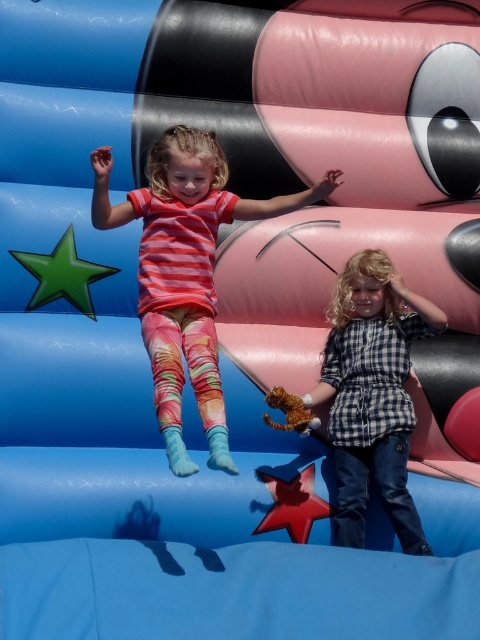
Question: Which point is farther from the camera taking this photo?

Choices:
 (A) (346, 465)
 (B) (170, 339)

Answer: (A)

Question: Among these points, which one is nearest to the camera?

Choices:
 (A) (391, 490)
 (B) (173, 328)

Answer: (B)

Question: Which object appears farthest from the camera in this image?

Choices:
 (A) checkered fabric shirt at center
 (B) striped cotton shirt at upper center

Answer: (A)

Question: Does striped cotton shirt at upper center appear over checkered fabric shirt at center?

Choices:
 (A) yes
 (B) no

Answer: (A)

Question: Can you confirm if striped cotton shirt at upper center is positioned to the right of checkered fabric shirt at center?

Choices:
 (A) yes
 (B) no

Answer: (B)

Question: Can you confirm if striped cotton shirt at upper center is positioned above checkered fabric shirt at center?

Choices:
 (A) yes
 (B) no

Answer: (A)